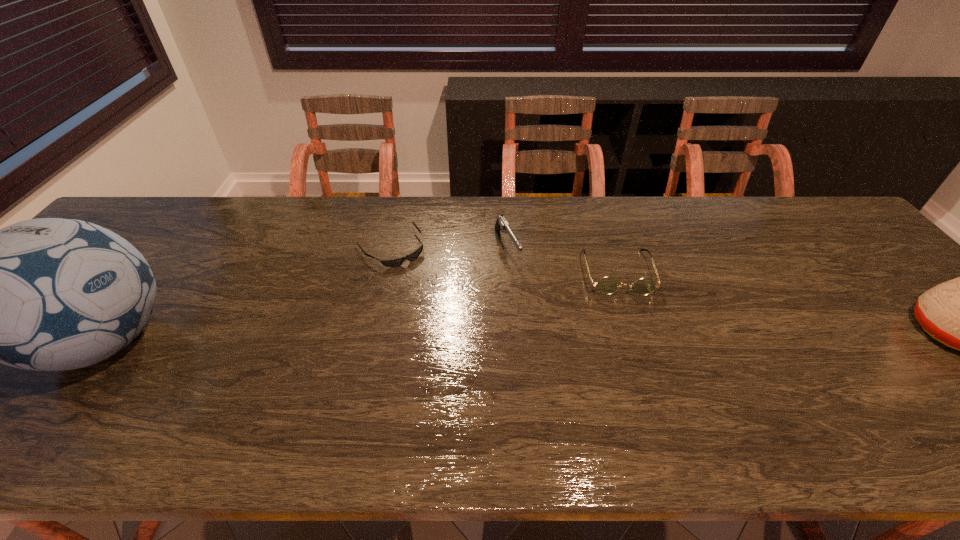
This screenshot has height=540, width=960. I want to click on vacant space located on the lenses of the fourth object from left to right, so click(649, 393).

At what (x,y) coordinates should I click in order to perform the action: click on vacant region located 0.150m on the lenses of the fourth object from left to right. Please return your answer as a coordinate pair (x, y). The image size is (960, 540). Looking at the image, I should click on (636, 343).

You are a GUI agent. You are given a task and a screenshot of the screen. Output one action in this format:
    pyautogui.click(x=<x>, y=<y>)
    Task: Click on the free space located 0.130m on the front-facing side of the pistol
    The image size is (960, 540).
    Given the screenshot: What is the action you would take?
    pyautogui.click(x=531, y=300)

Find the location of a particular element. This screenshot has width=960, height=540. free region located on the front-facing side of the pistol is located at coordinates point(525,289).

Identify the location of free region located 0.230m on the front-facing side of the pistol. (x=547, y=329).

What are the coordinates of `sunglasses located at the far edge` in the screenshot? It's located at (395, 262).

Locate an element on the screen. The width and height of the screenshot is (960, 540). pistol situated at the far edge is located at coordinates (501, 224).

This screenshot has height=540, width=960. In the image, there is a desktop. What are the coordinates of `vacant space at the far edge` in the screenshot? It's located at (x=735, y=224).

This screenshot has width=960, height=540. I want to click on free location at the near edge of the desktop, so click(x=224, y=393).

Find the location of `vacant space at the left edge of the desktop`. vacant space at the left edge of the desktop is located at coordinates pos(146,251).